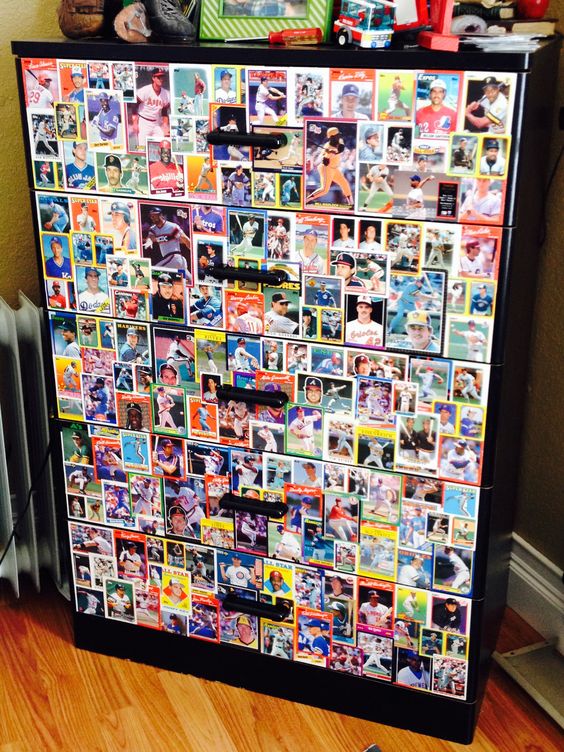
Find the location of a particular element. green picture frame is located at coordinates (x=224, y=29).